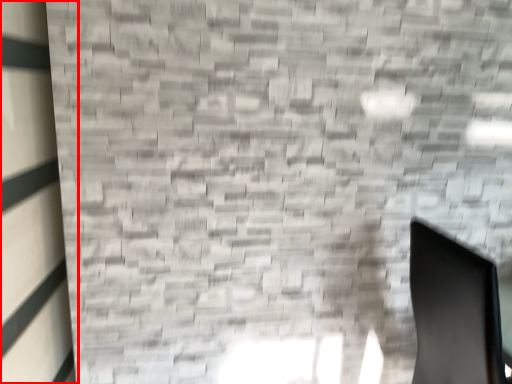
Question: From the image's perspective, where is window (annotated by the red box) located relative to swivel chair?

Choices:
 (A) below
 (B) above

Answer: (B)